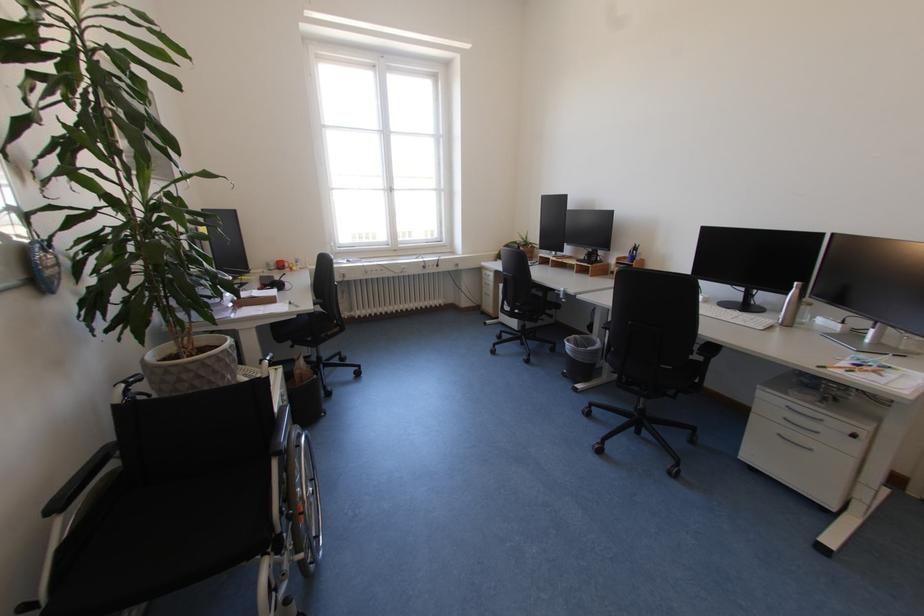
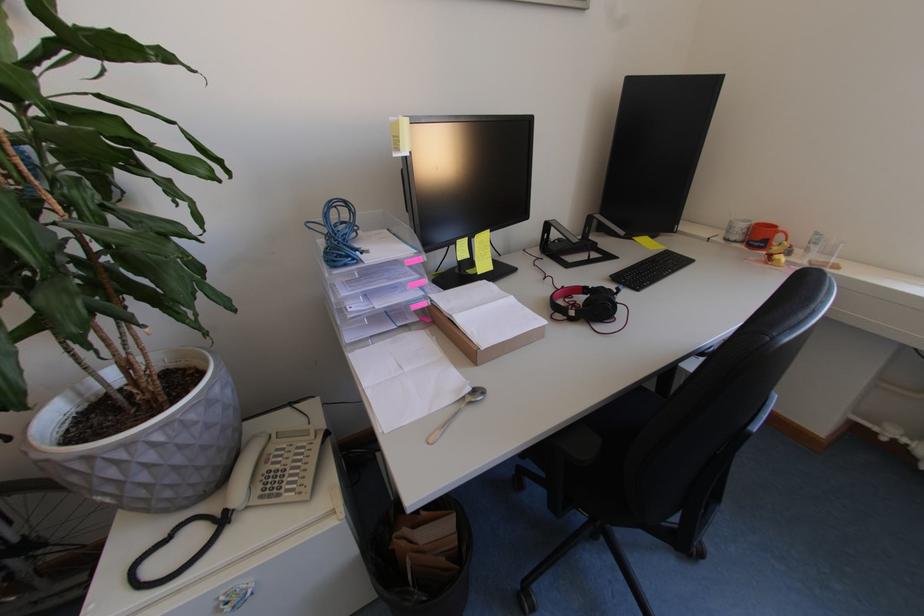
Find the pixel in the second image that matches point (306, 265) in the first image.

(816, 253)